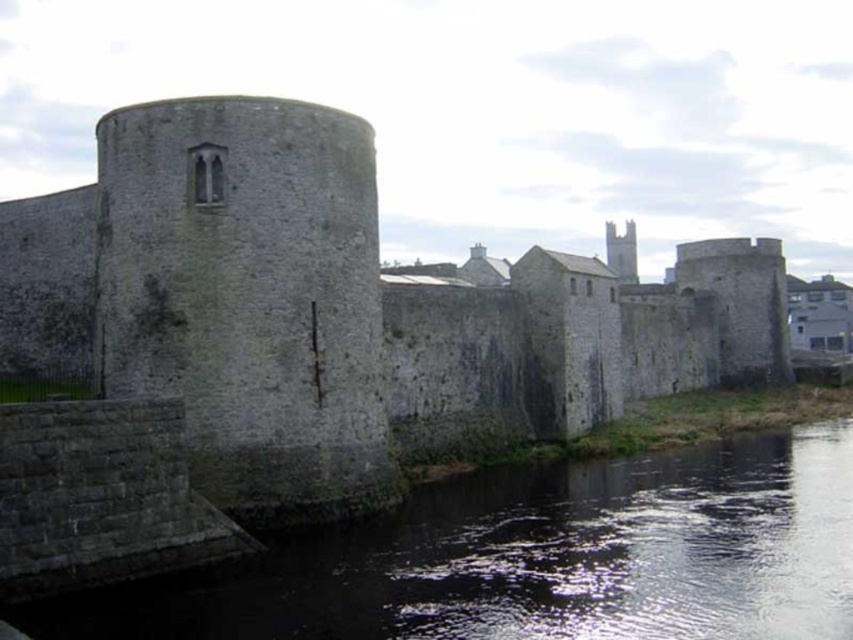
Question: Does stone wall at center lie behind dark gray stone river at lower center?

Choices:
 (A) no
 (B) yes

Answer: (B)

Question: Among these points, which one is nearest to the camera?

Choices:
 (A) (491, 637)
 (B) (28, 310)

Answer: (A)

Question: Which point appears farthest from the camera in this image?

Choices:
 (A) (468, 336)
 (B) (132, 612)

Answer: (A)

Question: Does stone wall at center appear over dark gray stone river at lower center?

Choices:
 (A) no
 (B) yes

Answer: (B)

Question: Does stone wall at center appear on the right side of dark gray stone river at lower center?

Choices:
 (A) yes
 (B) no

Answer: (B)